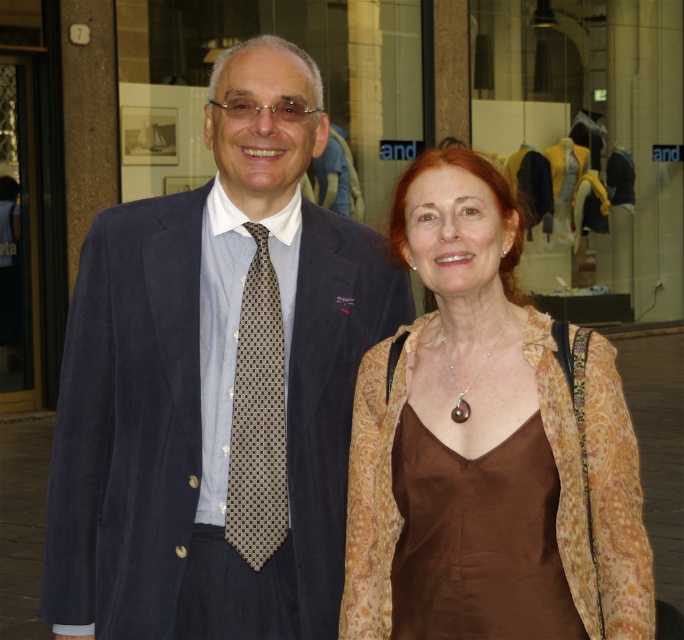
Which is in front, point (428, 557) or point (415, 460)?

Positioned in front is point (428, 557).

Which of these two, brown satin dress at center or brown silk dress at center, stands taller?

With more height is brown satin dress at center.

Is point (460, 385) positioned behind point (443, 616)?

Yes, it is behind point (443, 616).

Where is `brown satin dress at center`? brown satin dress at center is located at coordinates (486, 445).

Which is behind, point (153, 241) or point (527, 509)?

Point (153, 241)

Which is above, suede suit at center or brown silk dress at center?

suede suit at center is higher up.

I want to click on suede suit at center, so click(215, 385).

Locate an element on the screen. This screenshot has height=640, width=684. suede suit at center is located at coordinates (215, 385).

Who is more forward, (237, 456) or (231, 444)?

Point (237, 456)

Which is below, suede suit at center or brown dotted tie at center?

brown dotted tie at center is lower down.

Where is `suede suit at center`? suede suit at center is located at coordinates (215, 385).